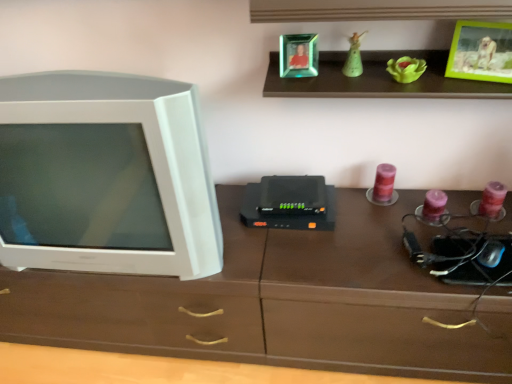
The height and width of the screenshot is (384, 512). What do you see at coordinates (481, 52) in the screenshot?
I see `green plastic picture frame at upper right, which is the 1th picture frame in right-to-left order` at bounding box center [481, 52].

Locate an element on the screen. The image size is (512, 384). white plastic television at left is located at coordinates [106, 176].

You are a GUI agent. You are given a task and a screenshot of the screen. Output one action in this format:
    pyautogui.click(x=<x>, y=<y>)
    Task: Click on the green plastic picture frame at upper right, which is the 1th picture frame in right-to-left order
    The image size is (512, 384).
    Given the screenshot: What is the action you would take?
    481,52

Does purple wax candle at center-right have a lesser width compared to white plastic television at left?

Correct, the width of purple wax candle at center-right is less than that of white plastic television at left.

Find the location of a particular element. television in front of the purple wax candle at center-right is located at coordinates (106, 176).

Would you consider purple wax candle at center-right to be distant from white plastic television at left?

purple wax candle at center-right is actually quite close to white plastic television at left.

Is purple wax candle at center-right taller than white plastic television at left?

No.

Is green plastic picture frame at upper right, which is the 2th picture frame from left to right, completely or partially outside of purple wax candle at center-right?

That's correct, green plastic picture frame at upper right, which is the 2th picture frame from left to right, is outside of purple wax candle at center-right.

Between green plastic picture frame at upper right, which is the 2th picture frame from left to right, and purple wax candle at center-right, which one has less height?

purple wax candle at center-right.

Are green plastic picture frame at upper right, which is the 1th picture frame in right-to-left order, and purple wax candle at center-right far apart?

They are positioned close to each other.

Where is `candle on the left side of green plastic picture frame at upper right, which is the 2th picture frame from left to right`? candle on the left side of green plastic picture frame at upper right, which is the 2th picture frame from left to right is located at coordinates (384, 183).

Considering the sizes of objects emerald glass photo frame at upper center, the 2th picture frame from the right, and green matte figurine at upper center in the image provided, who is shorter, emerald glass photo frame at upper center, the 2th picture frame from the right, or green matte figurine at upper center?

Standing shorter between the two is green matte figurine at upper center.

Between point (298, 63) and point (347, 65), which one is positioned behind?

Point (347, 65)

From the image's perspective, is emerald glass photo frame at upper center, the 1th picture frame from the left, positioned above or below green matte figurine at upper center?

emerald glass photo frame at upper center, the 1th picture frame from the left, is above green matte figurine at upper center.

From a real-world perspective, is emerald glass photo frame at upper center, the 1th picture frame from the left, above or below green matte figurine at upper center?

Clearly, from a real-world perspective, emerald glass photo frame at upper center, the 1th picture frame from the left, is above green matte figurine at upper center.

Is white plastic television at left taller or shorter than purple wax candle at center-right?

Clearly, white plastic television at left is taller compared to purple wax candle at center-right.

Considering the points (124, 133) and (376, 192), which point is behind, point (124, 133) or point (376, 192)?

The point (376, 192) is farther.

From the picture: Would you say white plastic television at left is inside or outside purple wax candle at center-right?

white plastic television at left is not inside purple wax candle at center-right, it's outside.

In terms of width, does white plastic television at left look wider or thinner when compared to purple wax candle at center-right?

Considering their sizes, white plastic television at left looks broader than purple wax candle at center-right.

Who is more distant, white plastic television at left or green matte figurine at upper center?

Positioned behind is green matte figurine at upper center.

In the image, is white plastic television at left on the left side or the right side of green matte figurine at upper center?

white plastic television at left is to the left of green matte figurine at upper center.

From the image's perspective, is white plastic television at left on top of green matte figurine at upper center?

No, from the image's perspective, white plastic television at left is not on top of green matte figurine at upper center.

Can you confirm if white plastic television at left is bigger than green matte figurine at upper center?

Yes.

From the image's perspective, is green matte figurine at upper center located beneath emerald glass photo frame at upper center, the 2th picture frame from the right?

Indeed, from the image's perspective, green matte figurine at upper center is shown beneath emerald glass photo frame at upper center, the 2th picture frame from the right.

What's the angular difference between green matte figurine at upper center and emerald glass photo frame at upper center, the 2th picture frame from the right,'s facing directions?

3.06 degrees.

Is emerald glass photo frame at upper center, the 2th picture frame from the right, inside green matte figurine at upper center?

No, emerald glass photo frame at upper center, the 2th picture frame from the right, is not a part of green matte figurine at upper center.

Is green matte figurine at upper center to the right of emerald glass photo frame at upper center, the 2th picture frame from the right, from the viewer's perspective?

Correct, you'll find green matte figurine at upper center to the right of emerald glass photo frame at upper center, the 2th picture frame from the right.

From the image's perspective, is green matte figurine at upper center under white plastic television at left?

No, from the image's perspective, green matte figurine at upper center is not below white plastic television at left.

Is green matte figurine at upper center at the right side of white plastic television at left?

Correct, you'll find green matte figurine at upper center to the right of white plastic television at left.

Based on the photo, in the image, is green matte figurine at upper center positioned in front of or behind white plastic television at left?

green matte figurine at upper center is behind white plastic television at left.

At what (x,y) coordinates should I click in order to perform the action: click on candle that appears on the right of white plastic television at left. Please return your answer as a coordinate pair (x, y). Looking at the image, I should click on (384, 183).

Where is `candle behind the green plastic picture frame at upper right, which is the 1th picture frame in right-to-left order`? candle behind the green plastic picture frame at upper right, which is the 1th picture frame in right-to-left order is located at coordinates (384, 183).

When comparing their distances from green plastic picture frame at upper right, which is the 2th picture frame from left to right, does green matte figurine at upper center or white plastic television at left seem further?

white plastic television at left.

From the image, which object appears to be farther from emerald glass photo frame at upper center, the 1th picture frame from the left, green matte figurine at upper center or white plastic television at left?

white plastic television at left lies further to emerald glass photo frame at upper center, the 1th picture frame from the left, than the other object.

Estimate the real-world distances between objects in this image. Which object is closer to emerald glass photo frame at upper center, the 1th picture frame from the left, green plastic picture frame at upper right, which is the 2th picture frame from left to right, or white plastic television at left?

Based on the image, green plastic picture frame at upper right, which is the 2th picture frame from left to right, appears to be nearer to emerald glass photo frame at upper center, the 1th picture frame from the left.

Based on their spatial positions, is green plastic picture frame at upper right, which is the 1th picture frame in right-to-left order, or green matte figurine at upper center further from white plastic television at left?

green plastic picture frame at upper right, which is the 1th picture frame in right-to-left order, is positioned further to the anchor white plastic television at left.

Looking at the image, which one is located further to green matte figurine at upper center, purple wax candle at center-right or emerald glass photo frame at upper center, the 1th picture frame from the left?

purple wax candle at center-right is positioned further to the anchor green matte figurine at upper center.

When comparing their distances from emerald glass photo frame at upper center, the 1th picture frame from the left, does white plastic television at left or purple wax candle at center-right seem further?

The object further to emerald glass photo frame at upper center, the 1th picture frame from the left, is white plastic television at left.

Looking at this image, estimate the real-world distances between objects in this image. Which object is closer to green matte figurine at upper center, purple wax candle at center-right or white plastic television at left?

purple wax candle at center-right is positioned closer to the anchor green matte figurine at upper center.

From the image, which object appears to be farther from purple wax candle at center-right, green plastic picture frame at upper right, which is the 1th picture frame in right-to-left order, or white plastic television at left?

white plastic television at left is further to purple wax candle at center-right.

Identify the location of candle between white plastic television at left and green plastic picture frame at upper right, which is the 1th picture frame in right-to-left order, from left to right. This screenshot has width=512, height=384. (384, 183).

Locate an element on the screen. picture frame between green matte figurine at upper center and purple wax candle at center-right from top to bottom is located at coordinates (481, 52).

Find the location of a particular element. The image size is (512, 384). candle between emerald glass photo frame at upper center, the 2th picture frame from the right, and green plastic picture frame at upper right, which is the 1th picture frame in right-to-left order is located at coordinates [x=384, y=183].

At what (x,y) coordinates should I click in order to perform the action: click on toy between emerald glass photo frame at upper center, the 1th picture frame from the left, and green plastic picture frame at upper right, which is the 1th picture frame in right-to-left order, in the horizontal direction. Please return your answer as a coordinate pair (x, y). The width and height of the screenshot is (512, 384). Looking at the image, I should click on (354, 57).